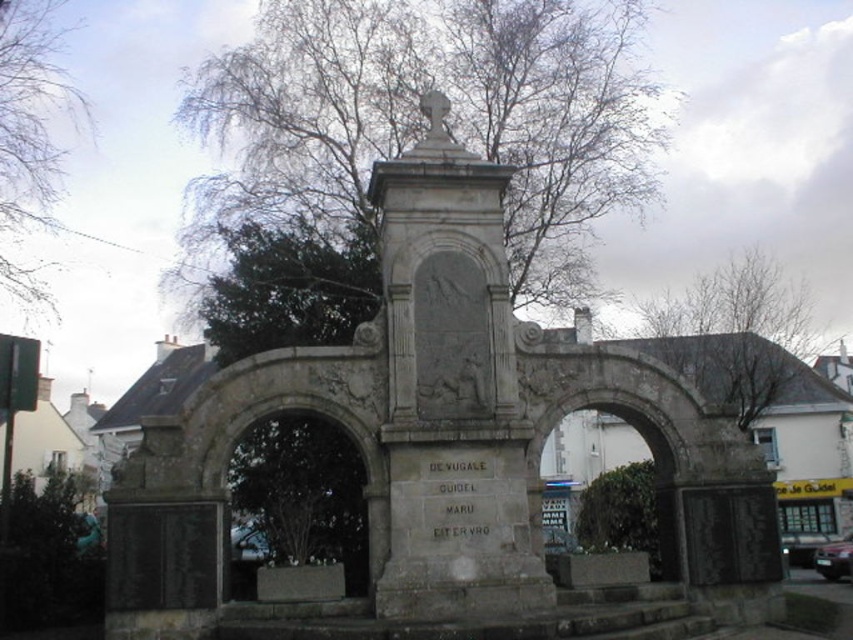
You are an artist sketching the scene. You want to ensure the proportions are accurate. Which object is narrower between the stone monument at center and the bare branches at upper center?

The stone monument at center has a lesser width compared to the bare branches at upper center, so the stone monument at center is narrower.

You are standing at the base of the stone monument and want to locate two specific points marked on the monument. The first point is at coordinate point (585, 106) and the second is at point (9, 20). From your vantage point, which point is closer to you?

Point (9, 20) is closer to you since point (585, 106) is behind it.